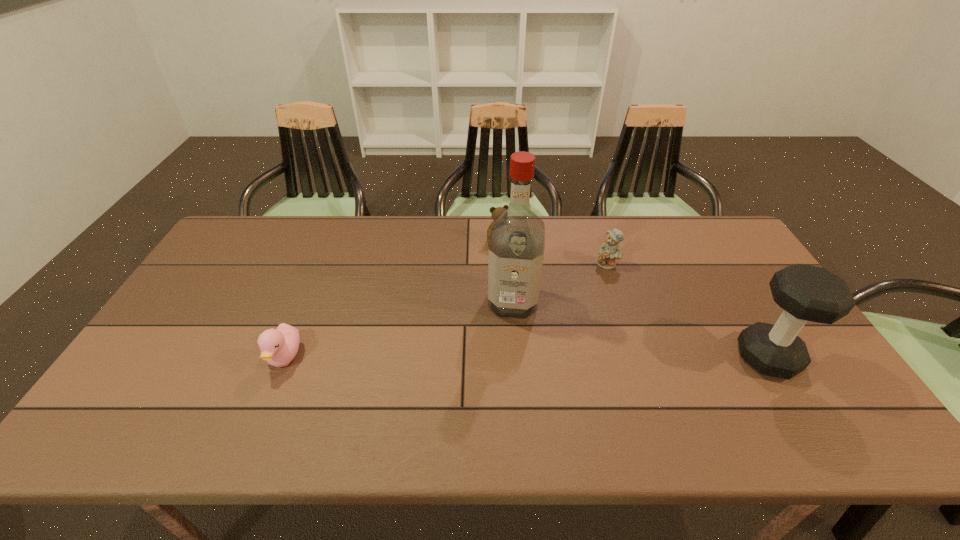
Where is `object that is positioned at the far edge`? The height and width of the screenshot is (540, 960). object that is positioned at the far edge is located at coordinates (497, 211).

Identify the location of duckling that is at the near edge. This screenshot has height=540, width=960. (279, 346).

At what (x,y) coordinates should I click in order to perform the action: click on dumbbell that is positioned at the near edge. Please return your answer as a coordinate pair (x, y). The image size is (960, 540). Looking at the image, I should click on (806, 293).

Find the location of a particular element. The image size is (960, 540). object that is positioned at the right edge is located at coordinates (806, 293).

What are the coordinates of `object present at the near right corner` in the screenshot? It's located at (806, 293).

In the image, there is a desktop. Find the location of `vacant space at the far edge`. vacant space at the far edge is located at coordinates (631, 219).

I want to click on vacant space at the near edge of the desktop, so click(x=548, y=379).

This screenshot has height=540, width=960. I want to click on free point at the left edge, so click(x=204, y=333).

Identify the location of vacant space at the far left corner of the desktop. (239, 235).

The height and width of the screenshot is (540, 960). In order to click on vacant space at the far right corner of the desktop in this screenshot , I will do `click(733, 235)`.